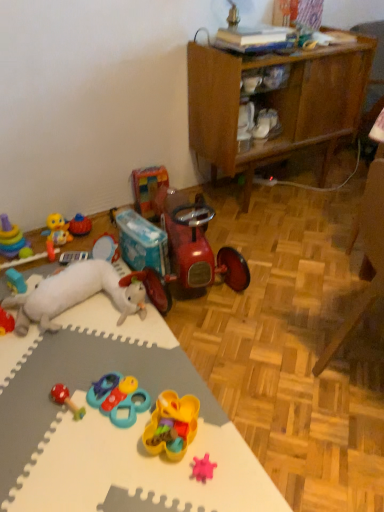
Where is `free space in front of white plush toy at upper left, the eighth toy when ordered from right to left`? This screenshot has height=512, width=384. free space in front of white plush toy at upper left, the eighth toy when ordered from right to left is located at coordinates (66, 384).